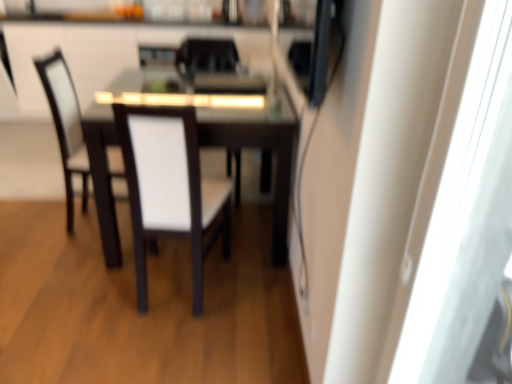
Locate an element on the screen. The width and height of the screenshot is (512, 384). free space that is in between white fabric chair at center, the fourth chair from the back, and dark wood table at center is located at coordinates click(x=206, y=281).